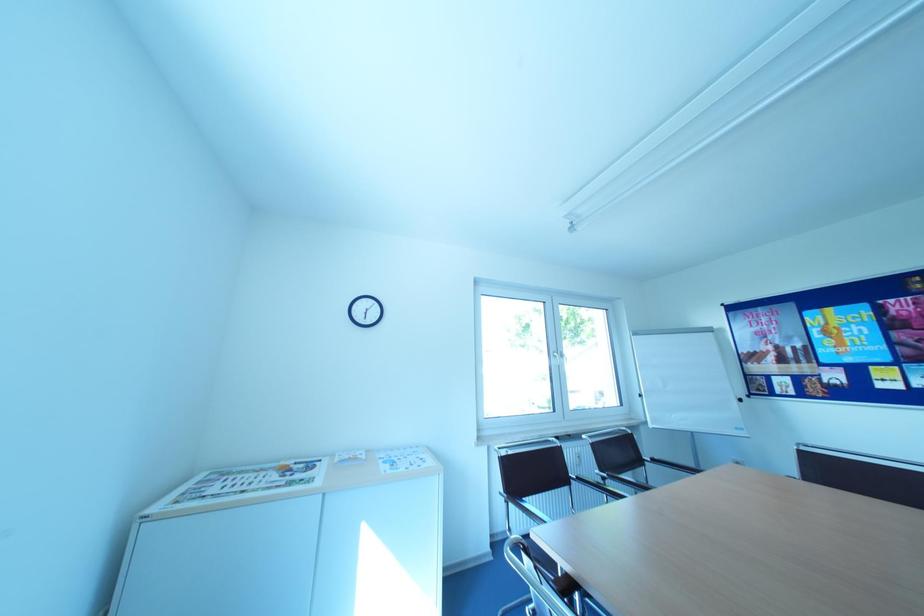
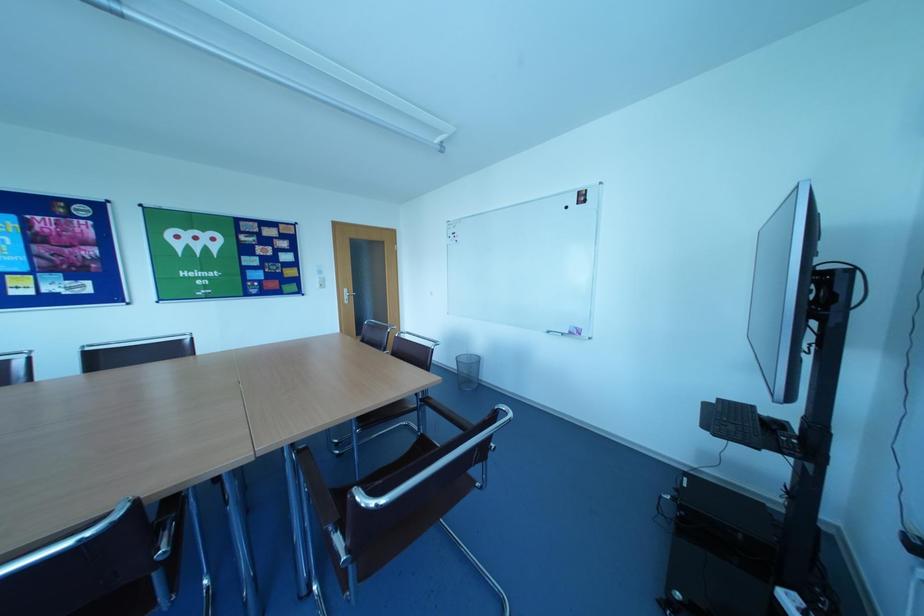
Question: Based on the continuous images, in which direction is the camera rotating? Reply with the corresponding letter.

Choices:
 (A) Left
 (B) Right
 (C) Up
 (D) Down

Answer: (B)